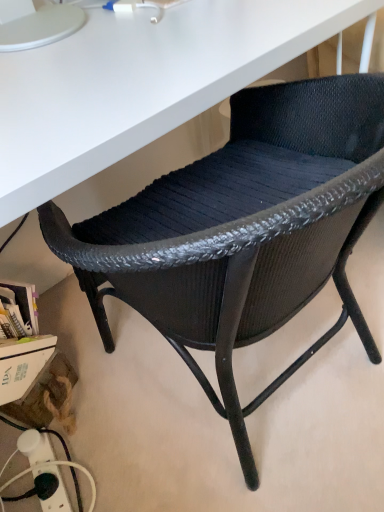
What are the coordinates of `free space above black woven chair at center (from a real-world perspective)` in the screenshot? It's located at (147, 75).